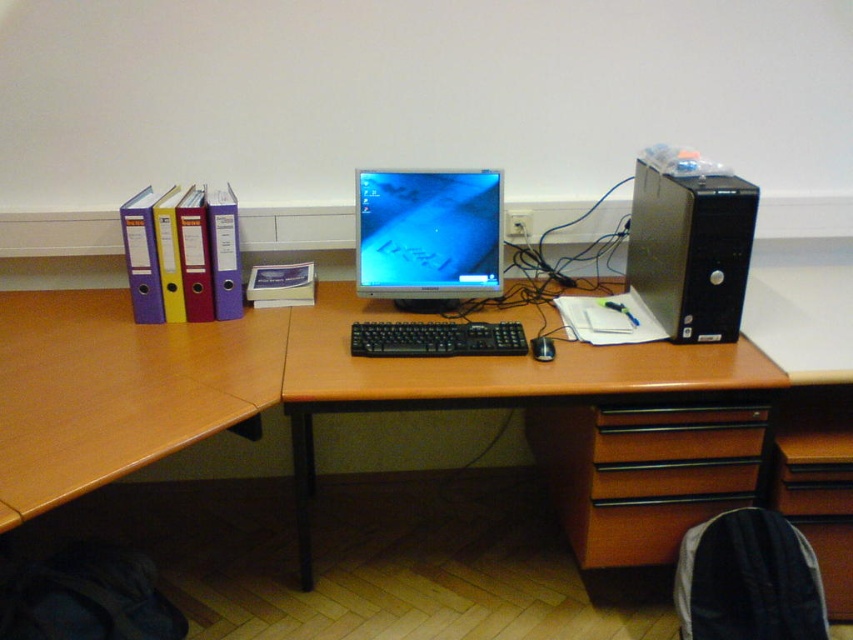
Question: Which object is the farthest from the black plastic keyboard at center?

Choices:
 (A) black plastic mouse at center
 (B) satin black tower at right
 (C) matte plastic monitor at center
 (D) brown wood drawer at lower right

Answer: (B)

Question: Considering the relative positions of brown wood computer desk at center and brown wood drawer at lower right in the image provided, where is brown wood computer desk at center located with respect to brown wood drawer at lower right?

Choices:
 (A) below
 (B) above

Answer: (B)

Question: Does black plastic keyboard at center appear under black plastic mouse at center?

Choices:
 (A) yes
 (B) no

Answer: (B)

Question: Estimate the real-world distances between objects in this image. Which object is farther from the matte plastic monitor at center?

Choices:
 (A) satin black tower at right
 (B) wooden desk at left
 (C) brown wood drawer at lower right

Answer: (C)

Question: Among these objects, which one is nearest to the camera?

Choices:
 (A) brown wood drawer at lower right
 (B) wooden desk at left

Answer: (B)

Question: In this image, where is black plastic keyboard at center located relative to black plastic mouse at center?

Choices:
 (A) left
 (B) right

Answer: (A)